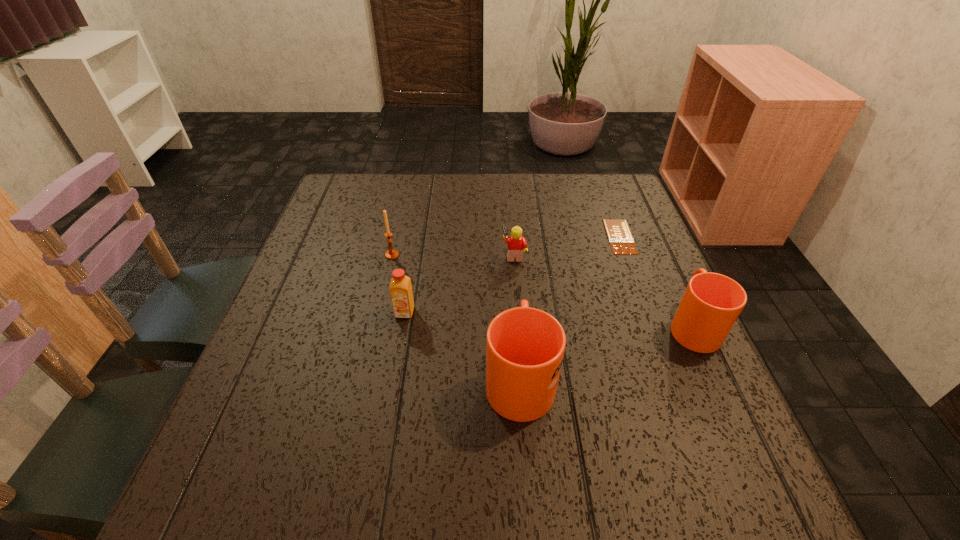
Please point a spot on the left to add another mug. Please provide its 2D coordinates. Your answer should be formatted as a tuple, i.e. [(x, y)], where the tuple contains the x and y coordinates of a point satisfying the conditions above.

[(302, 443)]